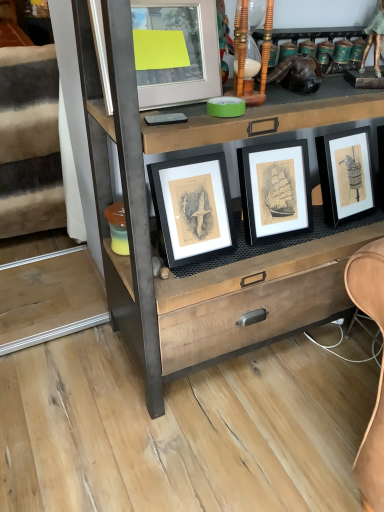
Question: In the image, is matte glass picture frame at upper center positioned in front of or behind wooden chest of drawers at center?

Choices:
 (A) front
 (B) behind

Answer: (B)

Question: From a real-world perspective, is matte glass picture frame at upper center physically located above or below wooden chest of drawers at center?

Choices:
 (A) below
 (B) above

Answer: (B)

Question: Considering the real-world distances, which object is farthest from the wooden chest of drawers at center?

Choices:
 (A) white fabric at left
 (B) matte glass picture frame at upper center

Answer: (A)

Question: Which object is the farthest from the white fabric at left?

Choices:
 (A) wooden chest of drawers at center
 (B) matte glass picture frame at upper center

Answer: (B)